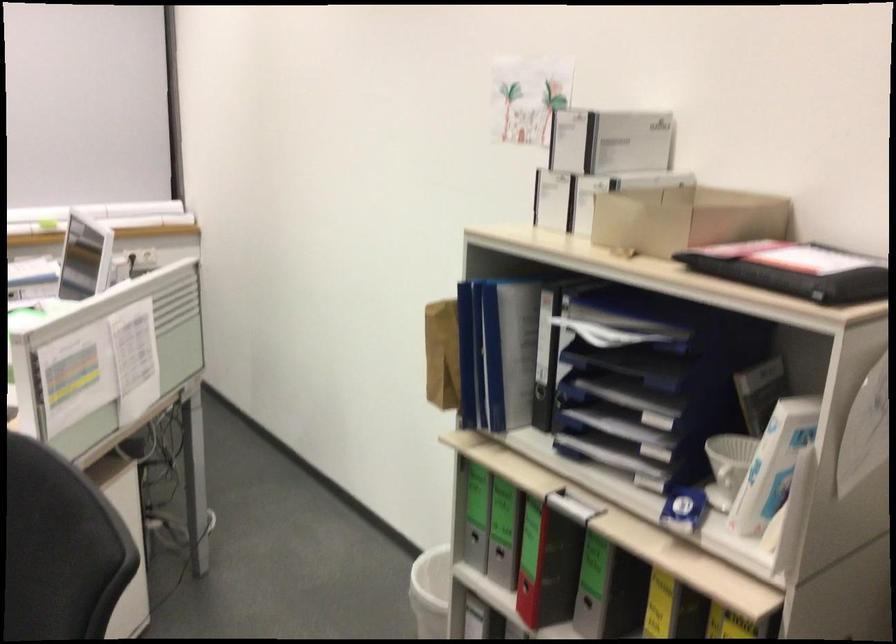
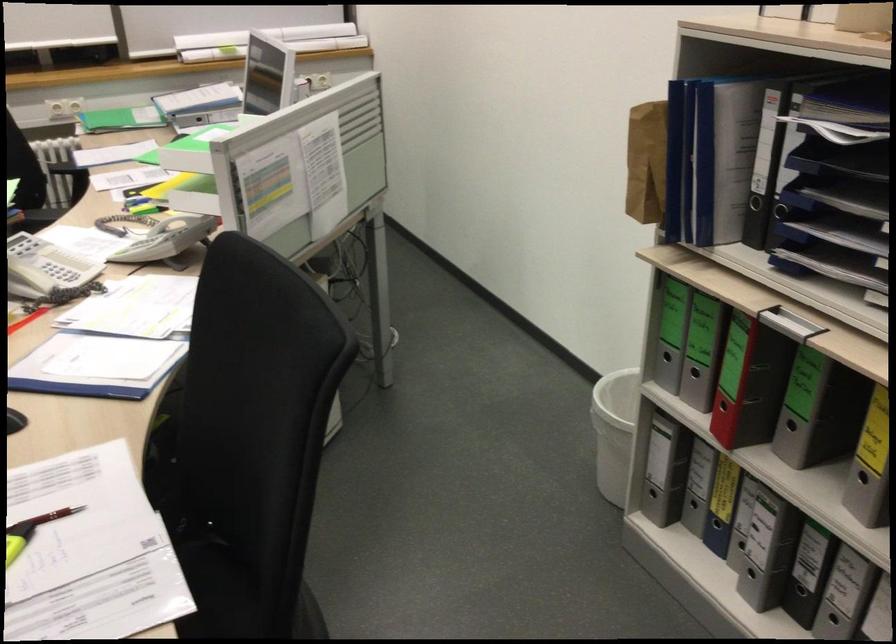
Where in the second image is the point corresponding to point (599, 334) from the first image?

(836, 129)